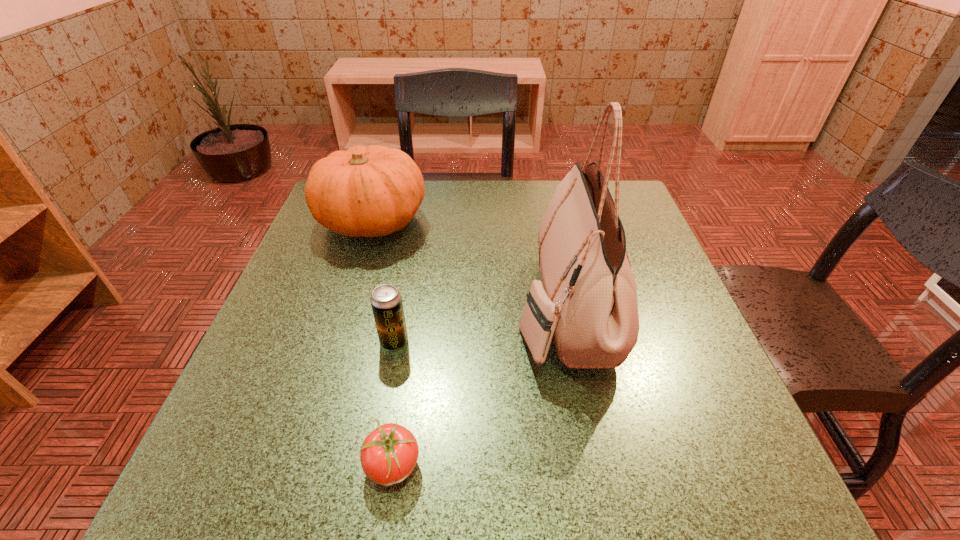
Identify the location of vacant space located 0.390m on the back of the beer can. pyautogui.click(x=418, y=215).

Where is `free region located on the back of the tomato`? This screenshot has width=960, height=540. free region located on the back of the tomato is located at coordinates (416, 314).

You are a GUI agent. You are given a task and a screenshot of the screen. Output one action in this format:
    pyautogui.click(x=<x>, y=<y>)
    Task: Click on the object that is at the far edge
    This screenshot has height=540, width=960.
    Given the screenshot: What is the action you would take?
    pyautogui.click(x=373, y=191)

In order to click on object present at the near edge in this screenshot , I will do `click(388, 455)`.

The height and width of the screenshot is (540, 960). What are the coordinates of `object present at the left edge` in the screenshot? It's located at (373, 191).

I want to click on object that is at the right edge, so click(586, 300).

Where is `object that is positioned at the far left corner`? object that is positioned at the far left corner is located at coordinates (373, 191).

Identify the location of vacant area at the far edge of the desktop. (431, 210).

Locate an element on the screen. The width and height of the screenshot is (960, 540). free space at the near edge of the desktop is located at coordinates (344, 453).

In the image, there is a desktop. Identify the location of vacant area at the left edge. The height and width of the screenshot is (540, 960). (239, 386).